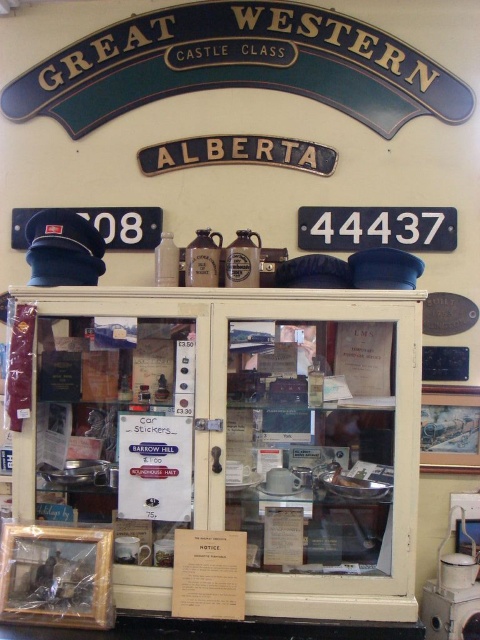
Can you confirm if white paper at center is wider than white paper notice at center?

Correct, the width of white paper at center exceeds that of white paper notice at center.

Where is `white paper at center`? The height and width of the screenshot is (640, 480). white paper at center is located at coordinates (155, 467).